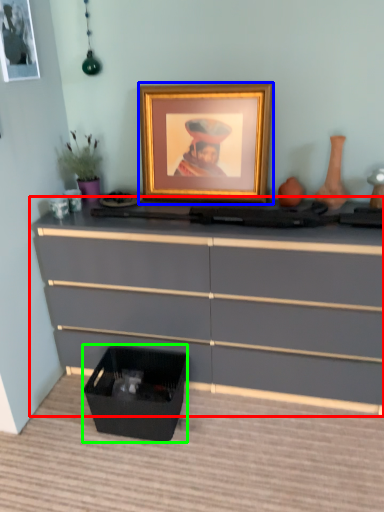
Question: Based on their relative distances, which object is nearer to chest of drawers (highlighted by a red box)? Choose from picture frame (highlighted by a blue box) and storage box (highlighted by a green box).

Choices:
 (A) picture frame
 (B) storage box

Answer: (B)